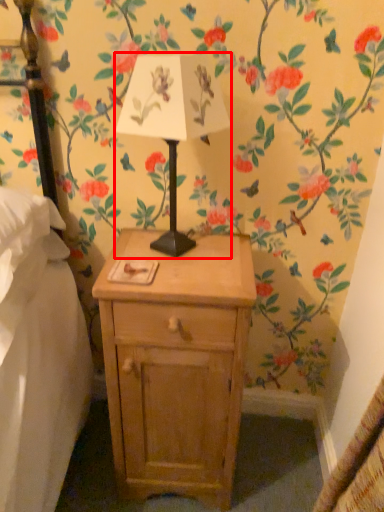
Question: Where is table lamp (annotated by the red box) located in relation to nightstand in the image?

Choices:
 (A) right
 (B) left

Answer: (B)